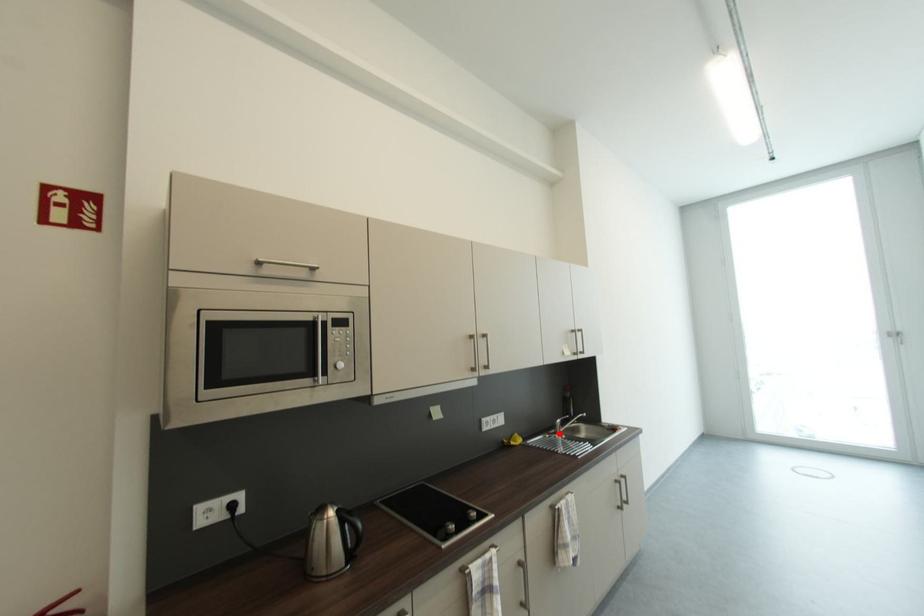
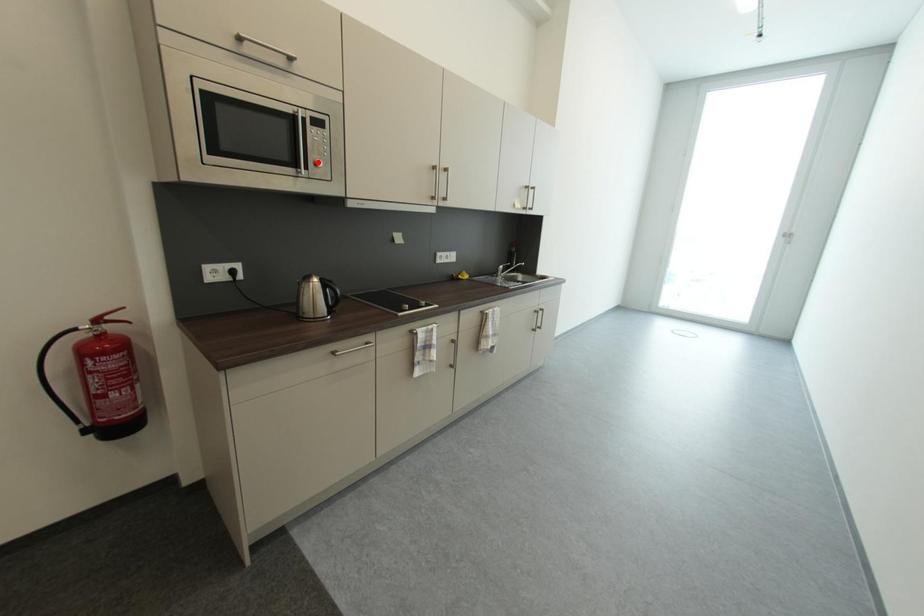
I am providing you with two images of the same scene from different viewpoints. A red point is marked on the first image and another point is marked on the second image. Do the highlighted points in image1 and image2 indicate the same real-world spot?

No